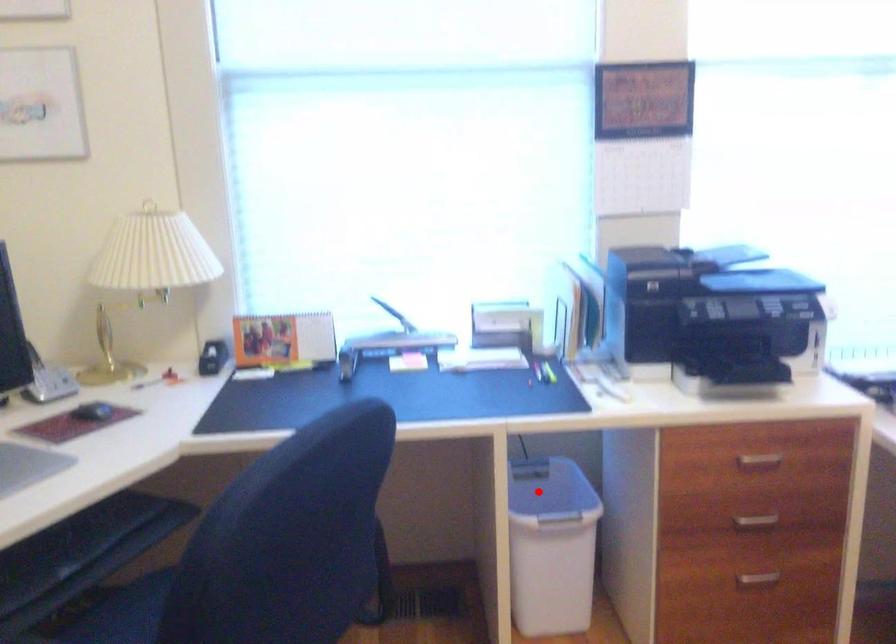
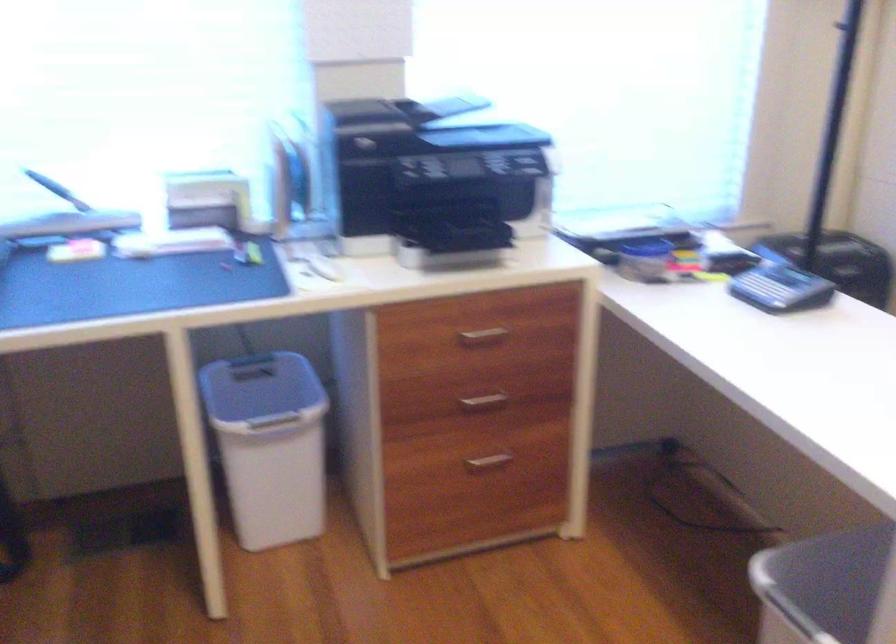
In the second image, find the point that corresponds to the highlighted location in the first image.

(261, 390)